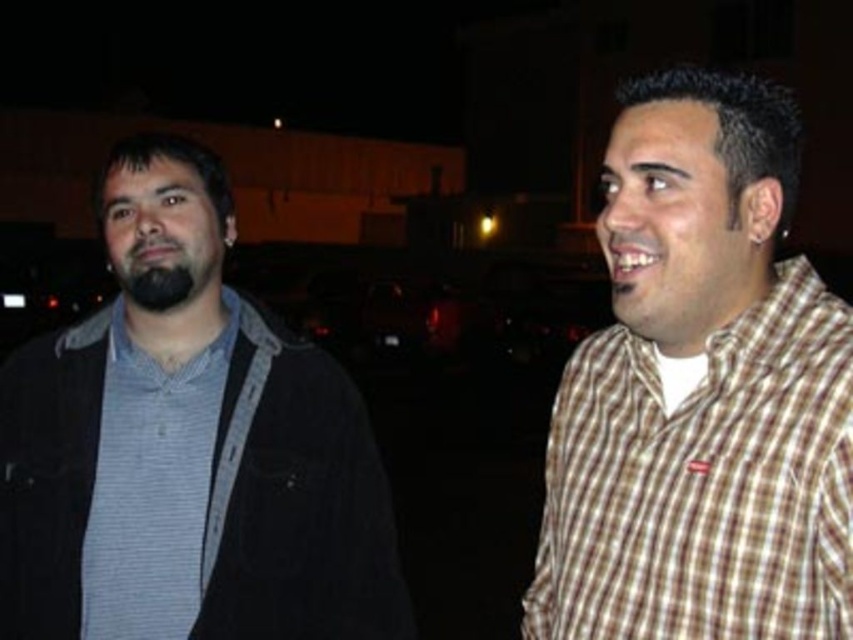
You are a fashion designer analyzing the outfits of two people in an urban night scene. You notice the matte black jacket at left and the gray striped shirt at left. Which clothing item appears taller in the image?

The matte black jacket at left appears taller than the gray striped shirt at left in the image.

You are a photographer trying to focus on the point at coordinates point (x=186, y=448). Based on the scene description, which object should you adjust your camera to focus on?

The point (x=186, y=448) is on the matte black jacket at left, so you should adjust your camera to focus on the matte black jacket at left.

Consider the image. You are a photographer trying to position your camera to capture both people in the scene. The camera has a rectangular sensor with a 16x9 aspect ratio. The sensor can only capture objects within its frame, which is defined by the sensor dimensions. Given that the sensor can only capture objects within its frame, which is defined by the sensor dimensions, can you determine if the brown checkered shirt at right will be fully visible in the frame if the camera is positioned to include both subjects?

The brown checkered shirt at right is located at point [704,483]. Since the camera sensor has a 16x9 aspect ratio, the frame extends from 0 to 1 in both x and y coordinates. The coordinates of the brown checkered shirt at right fall within this range, so it will be fully visible in the frame.